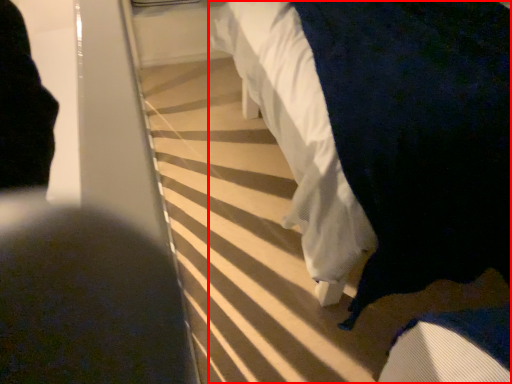
Question: Considering the relative positions of furniture (annotated by the red box) and person in the image provided, where is furniture (annotated by the red box) located with respect to the staircase?

Choices:
 (A) left
 (B) right

Answer: (B)